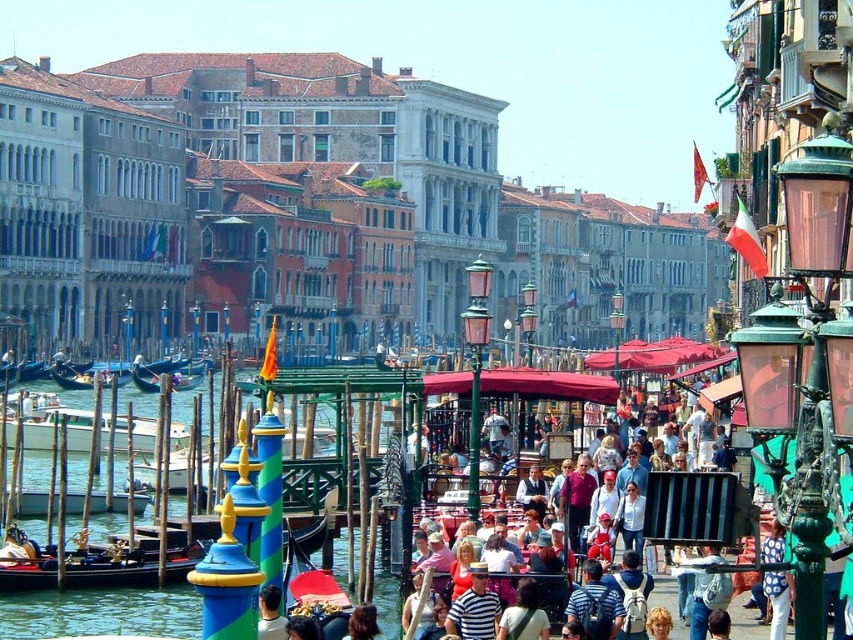
Based on the photo, can you confirm if black polished wood gondola at lower left is bigger than wooden gondola at left?

Incorrect, black polished wood gondola at lower left is not larger than wooden gondola at left.

Who is more distant from viewer, (1, 563) or (103, 381)?

Point (103, 381)

Locate an element on the screen. This screenshot has width=853, height=640. black polished wood gondola at lower left is located at coordinates [109, 566].

Who is positioned more to the left, black polished wood gondola at lower left or dark blue polished wood gondola at left?

dark blue polished wood gondola at left

Does black polished wood gondola at lower left appear under dark blue polished wood gondola at left?

Correct, black polished wood gondola at lower left is located below dark blue polished wood gondola at left.

Which is behind, point (30, 579) or point (154, 380)?

The point (154, 380) is more distant.

Identify the location of black polished wood gondola at lower left. This screenshot has height=640, width=853. (109, 566).

Between dark blue polished wood gondola at left and wooden gondola at left, which one has less height?

wooden gondola at left

Between dark blue polished wood gondola at left and wooden gondola at left, which one has more height?

dark blue polished wood gondola at left is taller.

Between point (141, 387) and point (109, 376), which one is positioned behind?

Positioned behind is point (109, 376).

This screenshot has width=853, height=640. In order to click on dark blue polished wood gondola at left in this screenshot , I will do `click(169, 376)`.